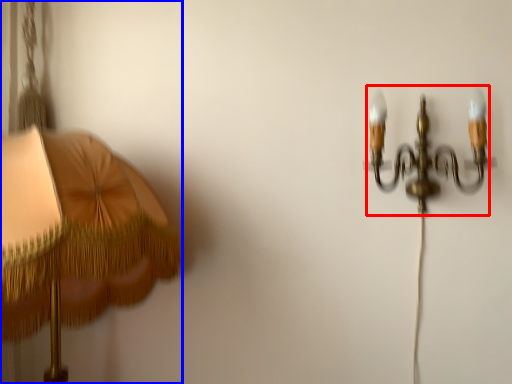
Question: Which point is further to the camera, lamp (highlighted by a red box) or lamp (highlighted by a blue box)?

Choices:
 (A) lamp
 (B) lamp

Answer: (A)